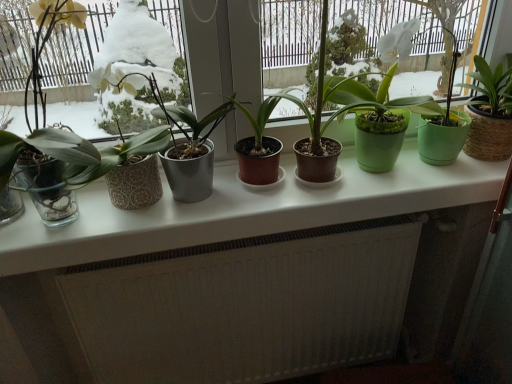
Question: Is white glossy counter top at center wider or thinner than metallic gray pot at center, which is the 4th houseplant in right-to-left order?

Choices:
 (A) thin
 (B) wide

Answer: (B)

Question: In the image, is white glossy counter top at center positioned in front of or behind metallic gray pot at center, which is the 4th houseplant in right-to-left order?

Choices:
 (A) behind
 (B) front

Answer: (A)

Question: Estimate the real-world distances between objects in this image. Which object is farther from the transparent glass window at left?

Choices:
 (A) white textured radiator at lower center
 (B) green matte pot at center, the first houseplant in the right-to-left sequence
 (C) metallic gray pot at center, arranged as the first houseplant when viewed from the left
 (D) brown matte pot at center, which is the third houseplant from right to left
 (E) white glossy counter top at center

Answer: (A)

Question: Which is farther from the green matte pot at center, the first houseplant in the right-to-left sequence?

Choices:
 (A) metallic gray pot at center, arranged as the first houseplant when viewed from the left
 (B) white textured radiator at lower center
 (C) transparent glass window at left
 (D) brown matte pot at center, placed as the 2th houseplant when sorted from left to right
 (E) white glossy counter top at center

Answer: (C)